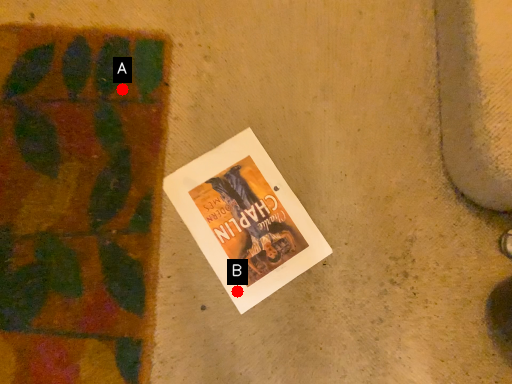
Question: Two points are circled on the image, labeled by A and B beside each circle. Which point is further to the camera?

Choices:
 (A) A is further
 (B) B is further

Answer: (A)